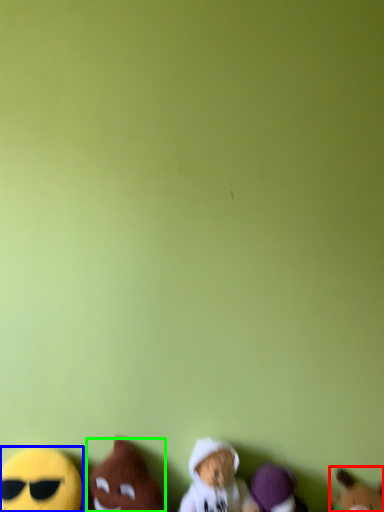
Question: Which is farther away from toy (highlighted by a red box)? toy (highlighted by a blue box) or toy (highlighted by a green box)?

Choices:
 (A) toy
 (B) toy

Answer: (A)